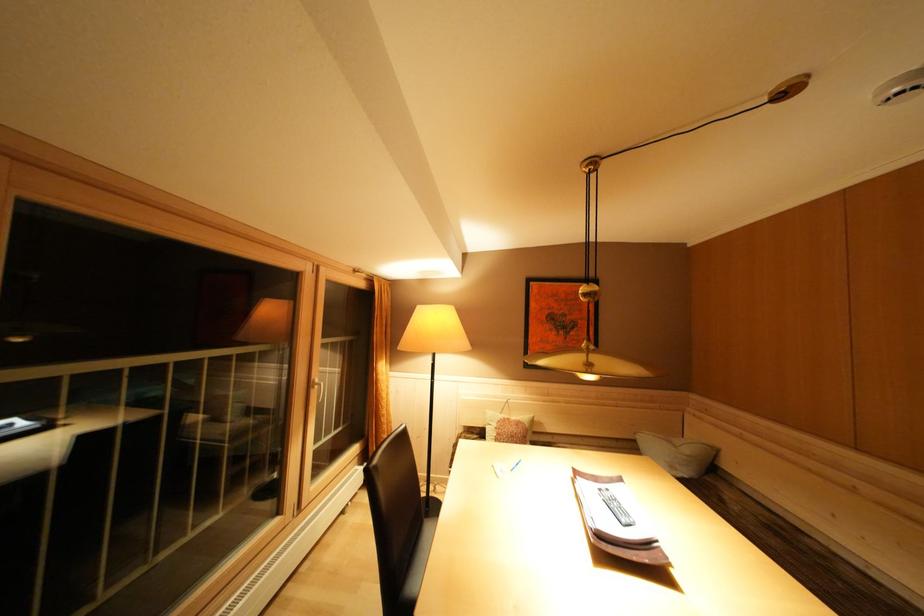
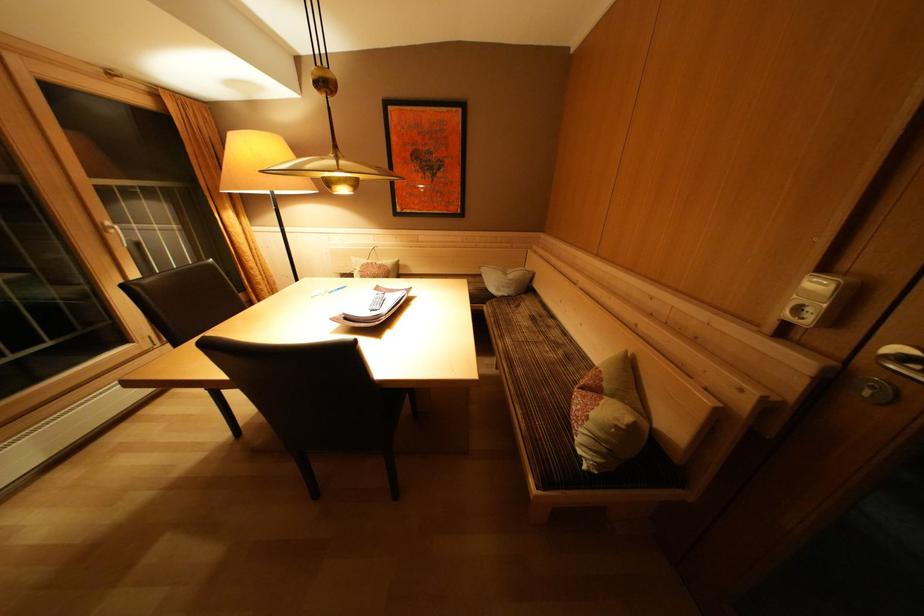
The point at (830,562) is marked in the first image. Where is the corresponding point in the second image?

(555, 331)